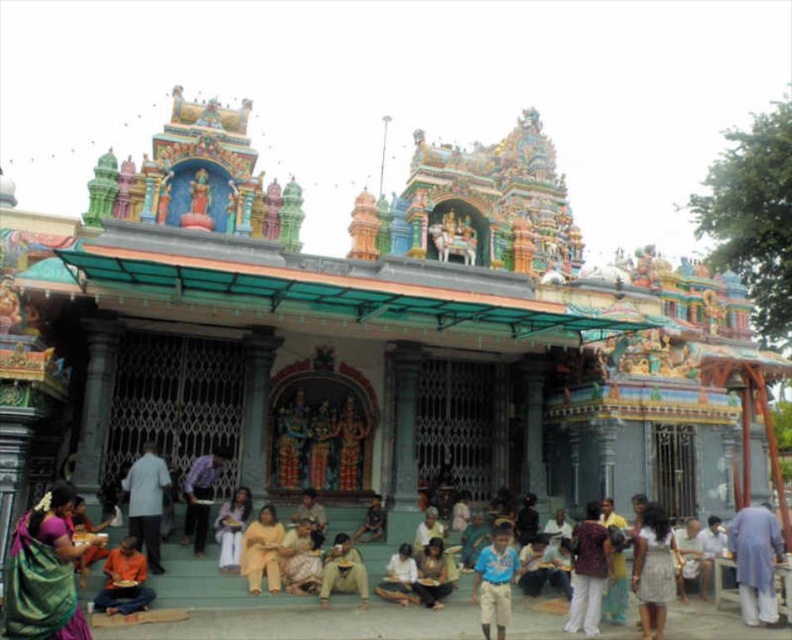
Question: Does multicolored painted temple at center appear on the right side of orange fabric at lower left?

Choices:
 (A) yes
 (B) no

Answer: (A)

Question: Which point is farther to the camera?

Choices:
 (A) light brown fabric skirt at center
 (B) green silk sari at center
 (C) dark blue fabric at center
 (D) multicolored painted temple at center

Answer: (C)

Question: Does multicolored painted temple at center have a larger size compared to matte yellow dress at center?

Choices:
 (A) yes
 (B) no

Answer: (A)

Question: Which object appears closest to the camera in this image?

Choices:
 (A) matte yellow dress at center
 (B) orange fabric at lower left
 (C) printed cotton shirt at center

Answer: (B)

Question: Which point is closer to the camera taking this photo?

Choices:
 (A) [x=381, y=529]
 (B) [x=737, y=593]
 (C) [x=196, y=624]
 (D) [x=219, y=518]

Answer: (C)

Question: Is light blue fabric shirt at lower left closer to the viewer compared to light blue shirt at center?

Choices:
 (A) yes
 (B) no

Answer: (B)